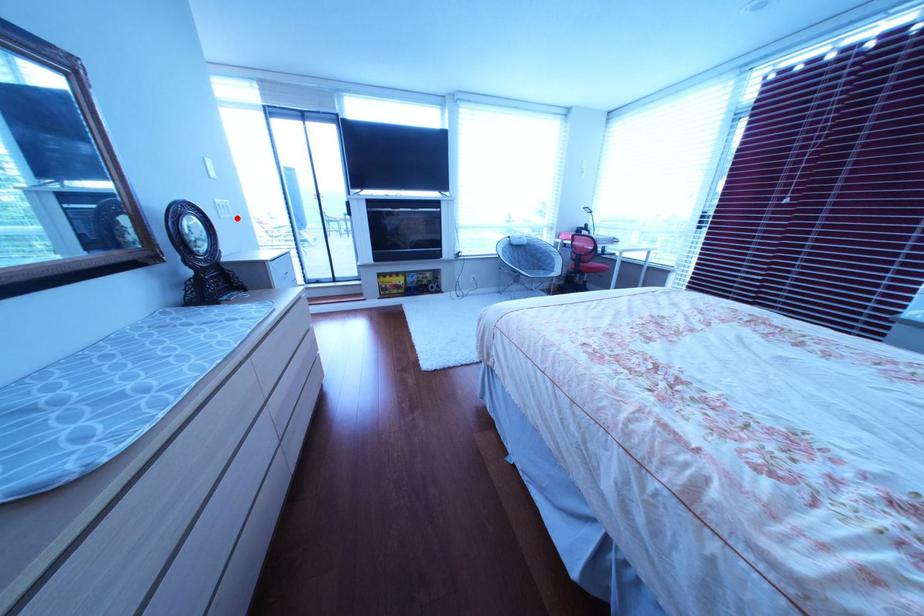
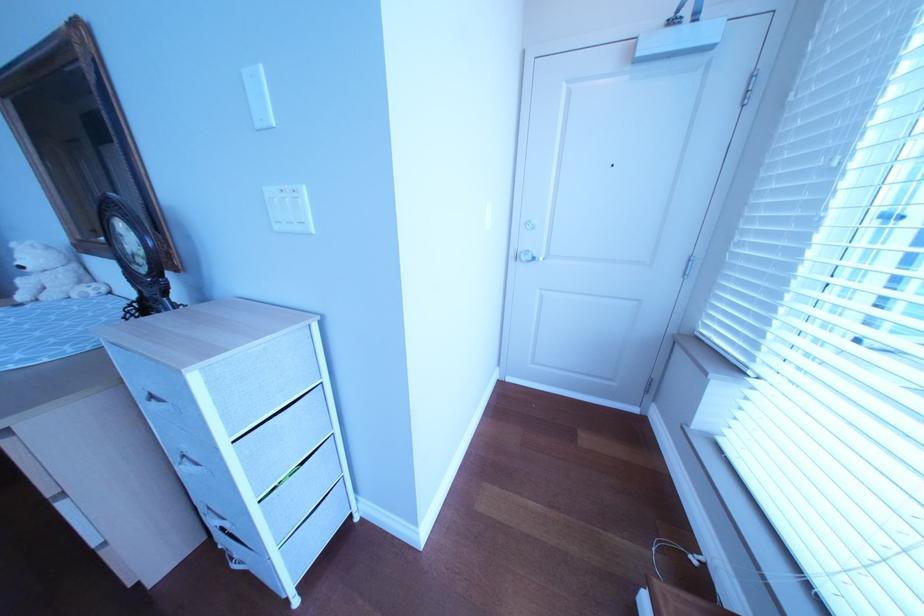
Question: I am providing you with two images of the same scene from different viewpoints. Given a red point in image1, look at the same physical point in image2. Is it:

Choices:
 (A) Closer to the viewpoint
 (B) Farther from the viewpoint

Answer: (B)